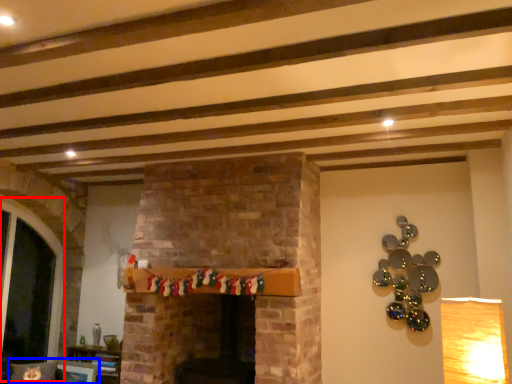
Question: Which of the following is the farthest to the observer, glass door (highlighted by a red box) or chair (highlighted by a blue box)?

Choices:
 (A) glass door
 (B) chair

Answer: (A)